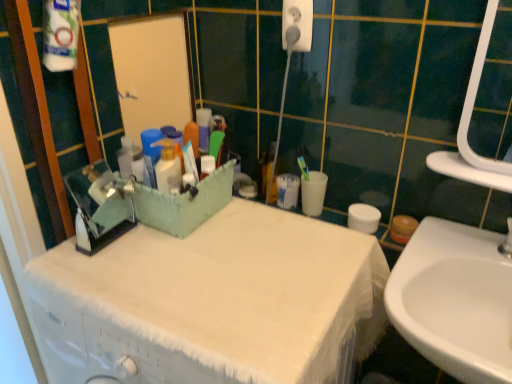
Question: Would you say white plastic electric outlet at upper center is a long distance from white glossy sink at lower right?

Choices:
 (A) yes
 (B) no

Answer: (B)

Question: Is white plastic electric outlet at upper center positioned before white glossy sink at lower right?

Choices:
 (A) yes
 (B) no

Answer: (B)

Question: From a real-world perspective, is white plastic electric outlet at upper center over white glossy sink at lower right?

Choices:
 (A) no
 (B) yes

Answer: (B)

Question: Does white plastic electric outlet at upper center have a lesser width compared to white glossy sink at lower right?

Choices:
 (A) yes
 (B) no

Answer: (A)

Question: Can you confirm if white plastic electric outlet at upper center is shorter than white glossy sink at lower right?

Choices:
 (A) yes
 (B) no

Answer: (A)

Question: Considering the positions of white glossy sink at lower right and white fabric-covered cabinet at center in the image, is white glossy sink at lower right wider or thinner than white fabric-covered cabinet at center?

Choices:
 (A) wide
 (B) thin

Answer: (B)

Question: In terms of size, does white glossy sink at lower right appear bigger or smaller than white fabric-covered cabinet at center?

Choices:
 (A) big
 (B) small

Answer: (B)

Question: From a real-world perspective, is white glossy sink at lower right physically located above or below white fabric-covered cabinet at center?

Choices:
 (A) above
 (B) below

Answer: (A)

Question: Relative to white fabric-covered cabinet at center, is white glossy sink at lower right in front or behind?

Choices:
 (A) front
 (B) behind

Answer: (B)

Question: Considering the positions of white plastic electric outlet at upper center and white fabric-covered cabinet at center in the image, is white plastic electric outlet at upper center taller or shorter than white fabric-covered cabinet at center?

Choices:
 (A) tall
 (B) short

Answer: (B)

Question: Is point (304, 34) positioned closer to the camera than point (331, 370)?

Choices:
 (A) closer
 (B) farther

Answer: (B)

Question: Is white plastic electric outlet at upper center spatially inside white fabric-covered cabinet at center, or outside of it?

Choices:
 (A) inside
 (B) outside

Answer: (B)

Question: Looking at their shapes, would you say white plastic electric outlet at upper center is wider or thinner than white fabric-covered cabinet at center?

Choices:
 (A) thin
 (B) wide

Answer: (A)

Question: Relative to white glossy sink at lower right, is white plastic electric outlet at upper center in front or behind?

Choices:
 (A) front
 (B) behind

Answer: (B)

Question: Is white plastic electric outlet at upper center spatially inside white glossy sink at lower right, or outside of it?

Choices:
 (A) outside
 (B) inside

Answer: (A)